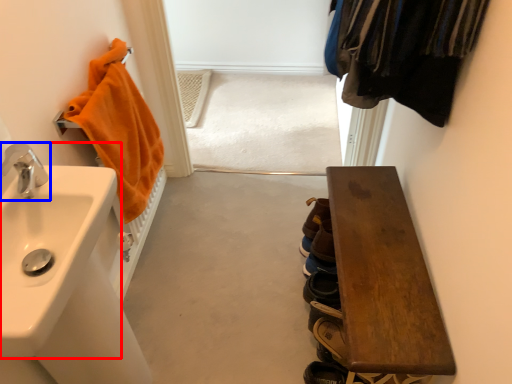
Question: Which object is further to the camera taking this photo, sink (highlighted by a red box) or tap (highlighted by a blue box)?

Choices:
 (A) sink
 (B) tap

Answer: (B)